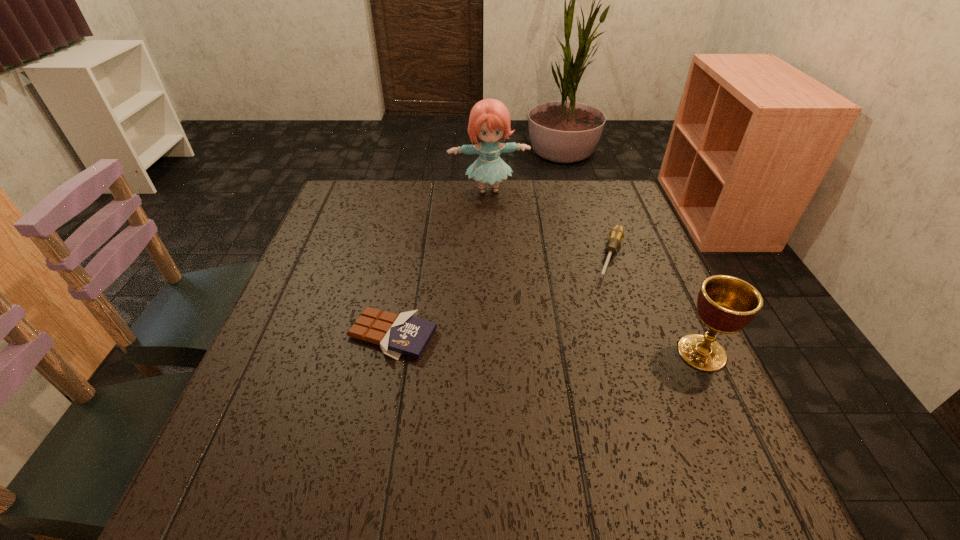
In order to click on chocolate bar in this screenshot , I will do `click(406, 334)`.

Where is `the third shortest object`? The width and height of the screenshot is (960, 540). the third shortest object is located at coordinates (726, 304).

Find the location of a particular element. This screenshot has width=960, height=540. chalice is located at coordinates (726, 304).

Identify the location of the third nearest object. Image resolution: width=960 pixels, height=540 pixels. (616, 235).

This screenshot has height=540, width=960. Identify the location of the second object from right to left. (616, 235).

Where is `doll`? Image resolution: width=960 pixels, height=540 pixels. doll is located at coordinates (489, 120).

You are a GUI agent. You are given a task and a screenshot of the screen. Output one action in this format:
    pyautogui.click(x=<x>, y=<y>)
    Task: Click on the tallest object
    The width and height of the screenshot is (960, 540).
    Given the screenshot: What is the action you would take?
    pyautogui.click(x=489, y=120)

Identify the location of vacant space situated on the left of the chocolate bar. This screenshot has width=960, height=540. (306, 335).

Where is `vacant space situated on the left of the third shortest object`? This screenshot has height=540, width=960. vacant space situated on the left of the third shortest object is located at coordinates (524, 353).

Find the location of a particular element. Image resolution: width=960 pixels, height=540 pixels. blank area located 0.390m at the tip of the screwdriver is located at coordinates (567, 417).